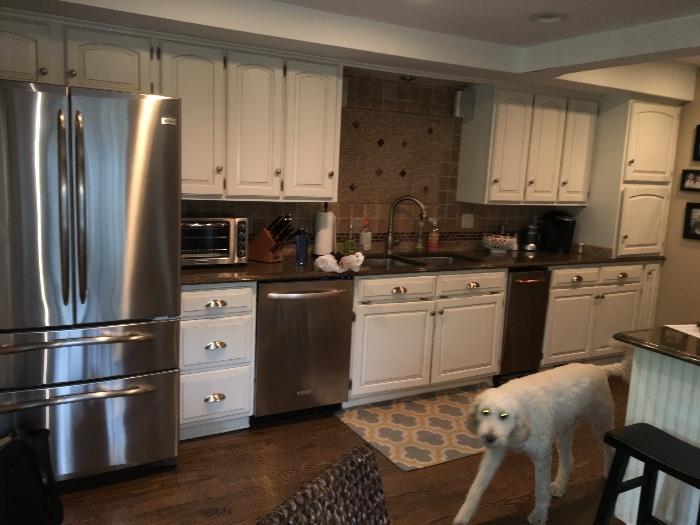
At what (x,y) coordinates should I click in order to perform the action: click on refrigerator handle. Please return your answer as a coordinate pair (x, y). Looking at the image, I should click on (80, 201), (66, 205).